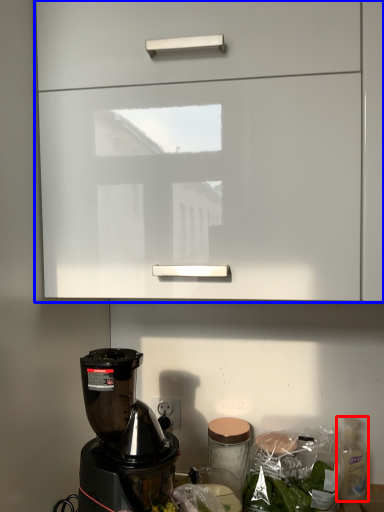
Question: Among these objects, which one is nearest to the camera, bottle (highlighted by a red box) or cabinetry (highlighted by a blue box)?

Choices:
 (A) bottle
 (B) cabinetry

Answer: (B)